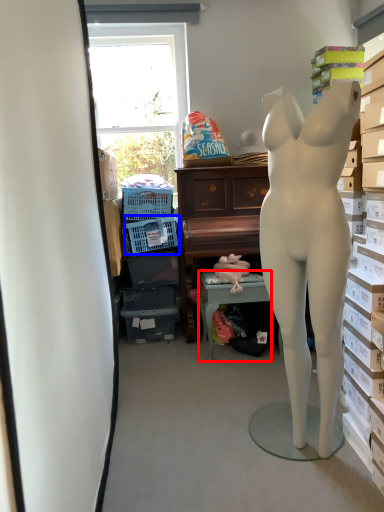
Question: Which of the following is the farthest to the observer, table (highlighted by a red box) or laundry basket (highlighted by a blue box)?

Choices:
 (A) table
 (B) laundry basket

Answer: (B)